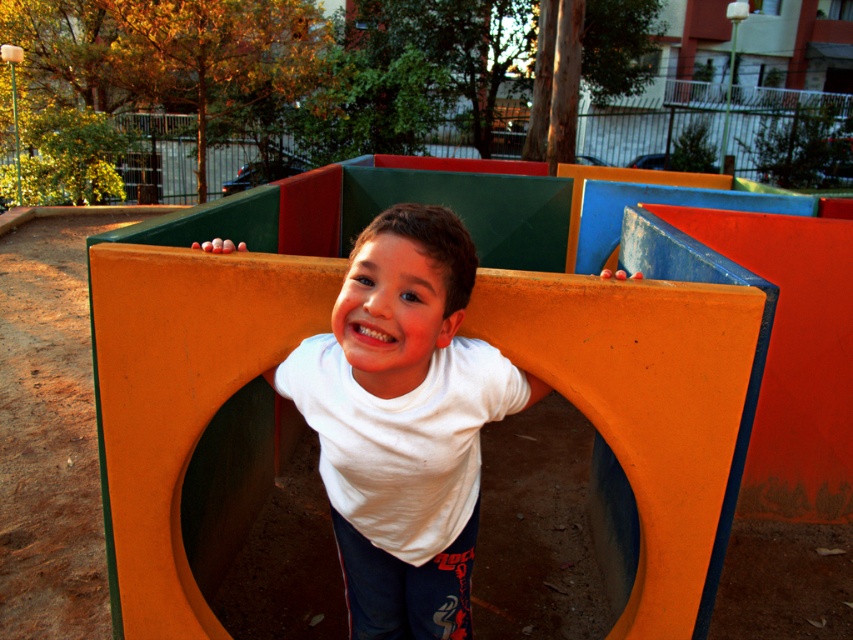
Between point (248, 436) and point (383, 451), which one is positioned behind?

Point (248, 436)

Does point (682, 611) come behind point (438, 288)?

That is True.

Does point (693, 493) lie in front of point (418, 483)?

No.

Locate an element on the screen. The image size is (853, 640). orange matte plastic at center is located at coordinates (467, 333).